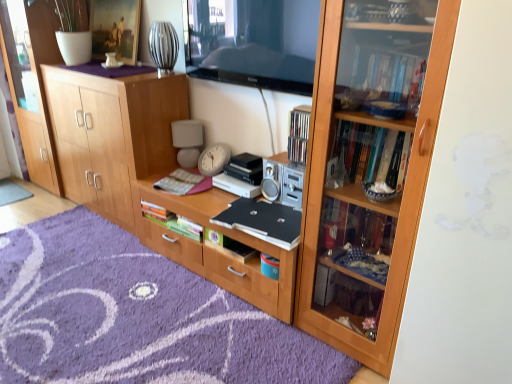
Question: Does transparent wood cabinet at left have a lesser height compared to wooden cabinet at center?

Choices:
 (A) no
 (B) yes

Answer: (A)

Question: Does transparent wood cabinet at left have a smaller size compared to wooden cabinet at center?

Choices:
 (A) yes
 (B) no

Answer: (A)

Question: From the image's perspective, is transparent wood cabinet at left over wooden cabinet at center?

Choices:
 (A) no
 (B) yes

Answer: (B)

Question: Would you say transparent wood cabinet at left is outside wooden cabinet at center?

Choices:
 (A) yes
 (B) no

Answer: (A)

Question: Is transparent wood cabinet at left directly adjacent to wooden cabinet at center?

Choices:
 (A) yes
 (B) no

Answer: (B)

Question: Is wooden bookcase at right in front of or behind hardcover book at center, which ranks as the 3th book in bottom-to-top order, in the image?

Choices:
 (A) behind
 (B) front

Answer: (B)

Question: From the image's perspective, is wooden bookcase at right located above or below hardcover book at center, which ranks as the 3th book in bottom-to-top order?

Choices:
 (A) below
 (B) above

Answer: (A)

Question: Is point (453, 33) positioned closer to the camera than point (207, 187)?

Choices:
 (A) farther
 (B) closer

Answer: (B)

Question: In the image, is wooden bookcase at right on the left side or the right side of hardcover book at center, placed as the 1th book when sorted from top to bottom?

Choices:
 (A) left
 (B) right

Answer: (B)

Question: From the image's perspective, is silver metallic stereo at center positioned above or below black matte laptop at center?

Choices:
 (A) below
 (B) above

Answer: (B)

Question: Is silver metallic stereo at center to the left or to the right of black matte laptop at center in the image?

Choices:
 (A) left
 (B) right

Answer: (B)

Question: From a real-world perspective, is silver metallic stereo at center above or below black matte laptop at center?

Choices:
 (A) above
 (B) below

Answer: (A)

Question: In terms of width, does silver metallic stereo at center look wider or thinner when compared to black matte laptop at center?

Choices:
 (A) wide
 (B) thin

Answer: (B)

Question: Looking at their shapes, would you say transparent wood cabinet at left is wider or thinner than gray fabric doormat at lower left, the first doormat from the left?

Choices:
 (A) wide
 (B) thin

Answer: (B)

Question: Is transparent wood cabinet at left bigger or smaller than gray fabric doormat at lower left, which appears as the first doormat when viewed from the back?

Choices:
 (A) big
 (B) small

Answer: (A)